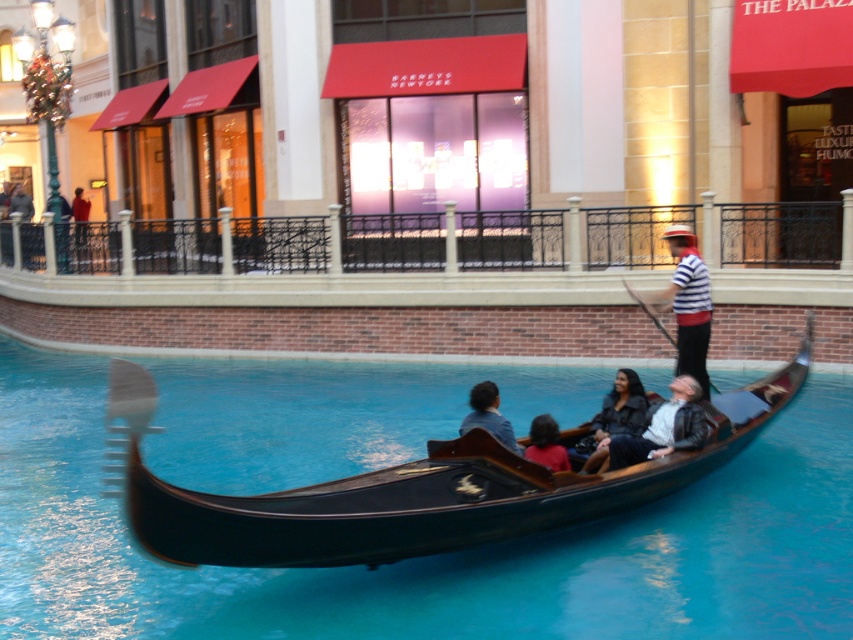
You are a photographer standing on the gondola ride and want to capture both the dark blue fabric shirt at center and the matte red shirt at center in a single photo. Which shirt should you focus on first to ensure both are in frame?

You should focus on the dark blue fabric shirt at center first since it is located above the matte red shirt at center, ensuring both are in the frame.

You are a photographer taking a picture of the striped cotton shirt at center and the matte red shirt at center. Which shirt should you focus on to ensure it takes up more space in the photo?

The striped cotton shirt at center is bigger than the matte red shirt at center, so focusing on it will ensure it takes up more space in the photo.